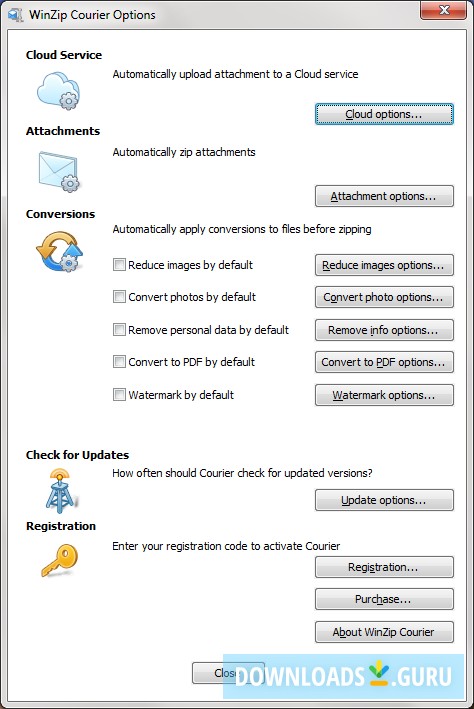
The image size is (474, 709). Identify the location of stool. (60, 498).